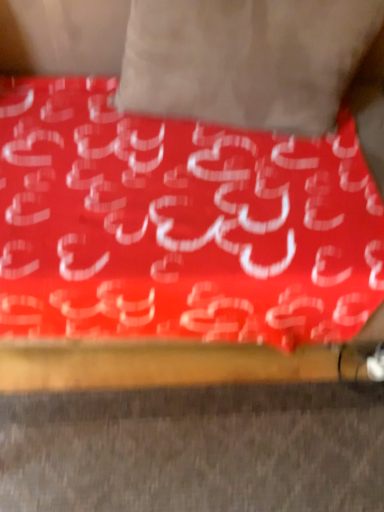
Locate an element on the screen. white soft pillow at upper center is located at coordinates (249, 59).

What is the approximate width of white soft pillow at upper center?

27.33 centimeters.

Describe the element at coordinates (249, 59) in the screenshot. I see `white soft pillow at upper center` at that location.

I want to click on white soft pillow at upper center, so pos(249,59).